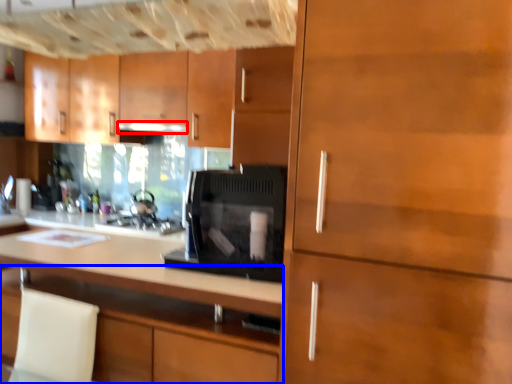
Question: Which of the following is the closest to the observer, exhaust hood (highlighted by a red box) or cabinetry (highlighted by a blue box)?

Choices:
 (A) exhaust hood
 (B) cabinetry

Answer: (B)